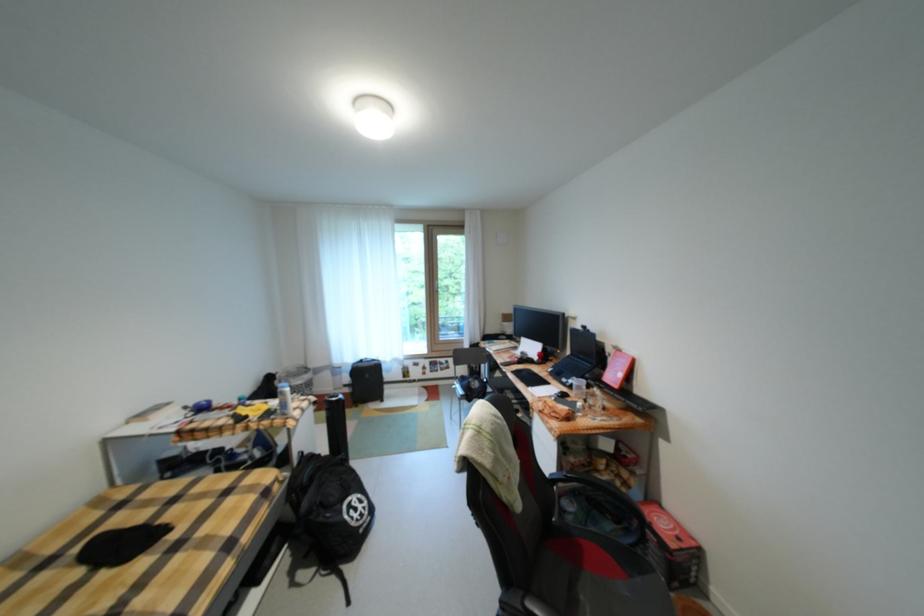
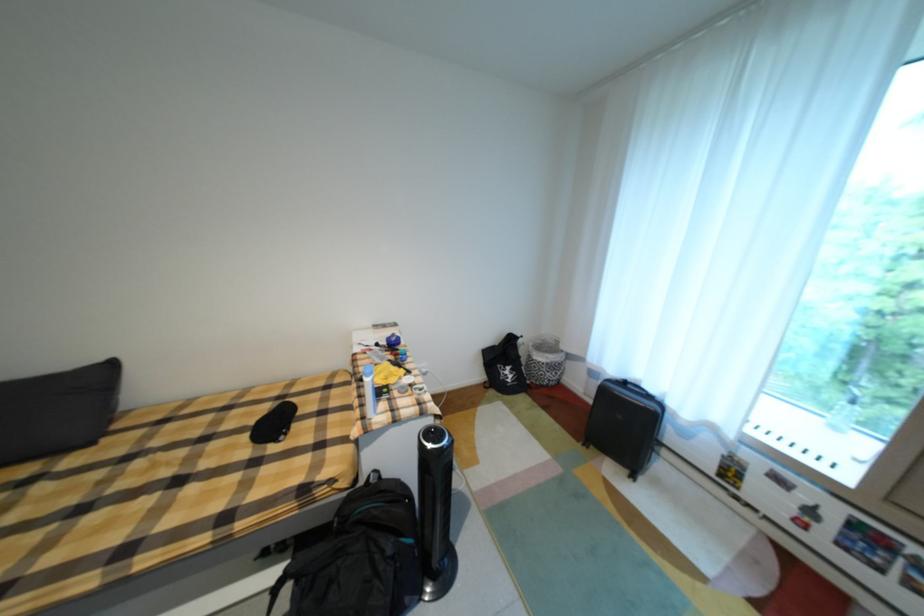
In the second image, find the point that corresponds to [287,374] in the first image.

(531, 338)